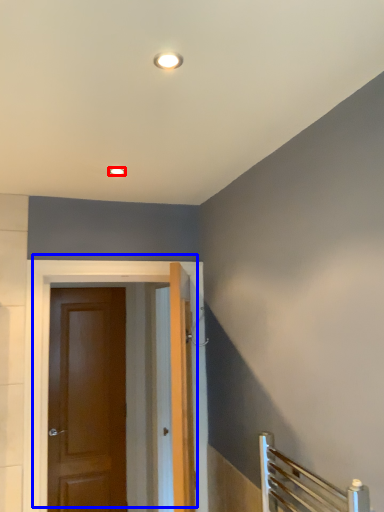
Question: Which object appears farthest to the camera in this image, lighting (highlighted by a red box) or door (highlighted by a blue box)?

Choices:
 (A) lighting
 (B) door

Answer: (B)